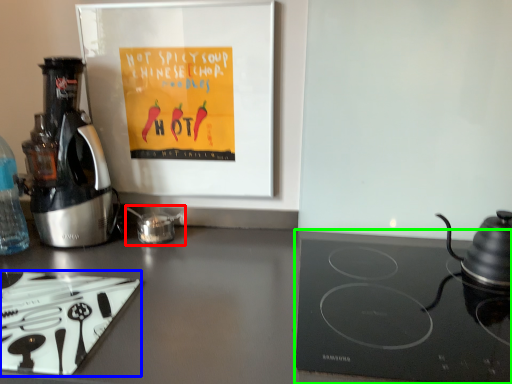
Question: Which object is positioned farthest from tea pot (highlighted by a red box)? Select from kitchen appliance (highlighted by a blue box) and gas stove (highlighted by a green box).

Choices:
 (A) kitchen appliance
 (B) gas stove

Answer: (B)